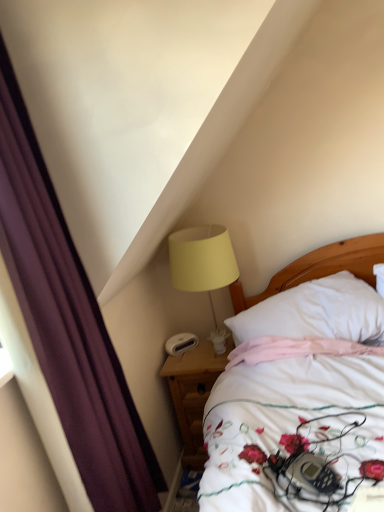
Measure the distance between point (207,353) and camera.

Point (207,353) is 2.22 meters away from camera.

Identify the location of yellow fabric lampshade at upper right. The image size is (384, 512). click(x=203, y=266).

You are a GUI agent. You are given a task and a screenshot of the screen. Output one action in this format:
    pyautogui.click(x=<x>, y=<y>)
    Task: Click on the purple fabric curtain at left
    The height and width of the screenshot is (512, 384).
    Given the screenshot: What is the action you would take?
    pyautogui.click(x=68, y=322)

Could wooden nightstand at lower center be considered to be inside white soft pillow at center?

No, wooden nightstand at lower center is located outside of white soft pillow at center.

From the image's perspective, is white soft pillow at center positioned above or below wooden nightstand at lower center?

white soft pillow at center is situated higher than wooden nightstand at lower center in the image.

Is point (300, 310) farther from camera compared to point (184, 462)?

That is False.

From the image's perspective, is yellow fabric lampshade at upper right under white soft pillow at center?

Actually, yellow fabric lampshade at upper right appears above white soft pillow at center in the image.

Is point (216, 269) positioned after point (301, 320)?

Yes, point (216, 269) is farther from viewer.

Is white soft pillow at center a part of yellow fabric lampshade at upper right?

No, white soft pillow at center is not a part of yellow fabric lampshade at upper right.

In terms of size, does white soft pillow at center appear bigger or smaller than white plastic alarm clock at lower center?

In the image, white soft pillow at center appears to be larger than white plastic alarm clock at lower center.

Is white soft pillow at center far from white plastic alarm clock at lower center?

No.

Could you tell me if white soft pillow at center is turned towards white plastic alarm clock at lower center?

No, white soft pillow at center is not facing towards white plastic alarm clock at lower center.

From the image's perspective, would you say white soft pillow at center is shown under white plastic alarm clock at lower center?

No, from the image's perspective, white soft pillow at center is not below white plastic alarm clock at lower center.

Between white plastic alarm clock at lower center and white soft pillow at center, which one is positioned in front?

Positioned in front is white soft pillow at center.

Consider the image. Can you see white plastic alarm clock at lower center touching white soft pillow at center?

No, white plastic alarm clock at lower center is not in contact with white soft pillow at center.

Considering the relative sizes of white plastic alarm clock at lower center and white soft pillow at center in the image provided, is white plastic alarm clock at lower center smaller than white soft pillow at center?

Yes.

Which of these two, white plastic alarm clock at lower center or white soft pillow at center, is thinner?

With smaller width is white plastic alarm clock at lower center.

Is there a large distance between white plastic alarm clock at lower center and yellow fabric lampshade at upper right?

No, white plastic alarm clock at lower center is not far away from yellow fabric lampshade at upper right.

Which is more to the right, white plastic alarm clock at lower center or yellow fabric lampshade at upper right?

yellow fabric lampshade at upper right.

Between white plastic alarm clock at lower center and yellow fabric lampshade at upper right, which one is positioned behind?

white plastic alarm clock at lower center is further from the camera.

Is point (188, 342) in front of point (235, 280)?

No, (188, 342) is behind (235, 280).

From the image's perspective, does white plastic alarm clock at lower center appear higher than wooden nightstand at lower center?

Correct, white plastic alarm clock at lower center appears higher than wooden nightstand at lower center in the image.

Would you say white plastic alarm clock at lower center contains wooden nightstand at lower center?

No, wooden nightstand at lower center is not inside white plastic alarm clock at lower center.

Considering the relative sizes of white plastic alarm clock at lower center and wooden nightstand at lower center in the image provided, is white plastic alarm clock at lower center wider than wooden nightstand at lower center?

No.

Is white plastic alarm clock at lower center at the left side of wooden nightstand at lower center?

Yes, white plastic alarm clock at lower center is to the left of wooden nightstand at lower center.

From a real-world perspective, is purple fabric curtain at left positioned above or below white soft pillow at center?

From a real-world perspective, purple fabric curtain at left is physically above white soft pillow at center.

Is purple fabric curtain at left situated inside white soft pillow at center or outside?

purple fabric curtain at left lies outside white soft pillow at center.

Which is more to the left, purple fabric curtain at left or white soft pillow at center?

purple fabric curtain at left.

Which of these two, purple fabric curtain at left or white soft pillow at center, stands taller?

purple fabric curtain at left.

Where is `nightstand below the white soft pillow at center (from the image's perspective)`? The image size is (384, 512). nightstand below the white soft pillow at center (from the image's perspective) is located at coordinates (194, 394).

Locate an element on the screen. This screenshot has height=512, width=384. pillow on the right side of yellow fabric lampshade at upper right is located at coordinates pyautogui.click(x=315, y=312).

Based on their spatial positions, is wooden nightstand at lower center or white soft pillow at center further from white plastic alarm clock at lower center?

Among the two, white soft pillow at center is located further to white plastic alarm clock at lower center.

When comparing their distances from purple fabric curtain at left, does yellow fabric lampshade at upper right or white soft pillow at center seem further?

white soft pillow at center lies further to purple fabric curtain at left than the other object.

Considering their positions, is white soft pillow at center positioned further to purple fabric curtain at left than wooden nightstand at lower center?

white soft pillow at center.

When comparing their distances from yellow fabric lampshade at upper right, does purple fabric curtain at left or white soft pillow at center seem closer?

white soft pillow at center.

Considering their positions, is wooden nightstand at lower center positioned further to purple fabric curtain at left than yellow fabric lampshade at upper right?

yellow fabric lampshade at upper right lies further to purple fabric curtain at left than the other object.

Considering their positions, is white soft pillow at center positioned closer to white plastic alarm clock at lower center than yellow fabric lampshade at upper right?

The object closer to white plastic alarm clock at lower center is yellow fabric lampshade at upper right.

Based on their spatial positions, is purple fabric curtain at left or wooden nightstand at lower center further from white plastic alarm clock at lower center?

purple fabric curtain at left.

Considering their positions, is purple fabric curtain at left positioned further to yellow fabric lampshade at upper right than wooden nightstand at lower center?

purple fabric curtain at left is further to yellow fabric lampshade at upper right.

Locate an element on the screen. This screenshot has height=512, width=384. alarm clock between yellow fabric lampshade at upper right and wooden nightstand at lower center in the up-down direction is located at coordinates (181, 343).

Locate an element on the screen. This screenshot has height=512, width=384. lamp positioned between purple fabric curtain at left and white plastic alarm clock at lower center from near to far is located at coordinates (203, 266).

You are a GUI agent. You are given a task and a screenshot of the screen. Output one action in this format:
    pyautogui.click(x=<x>, y=<y>)
    Task: Click on the pillow between purple fabric curtain at left and yellow fabric lampshade at upper right along the z-axis
    
    Given the screenshot: What is the action you would take?
    pyautogui.click(x=315, y=312)

The image size is (384, 512). I want to click on nightstand positioned between purple fabric curtain at left and white plastic alarm clock at lower center from near to far, so click(194, 394).